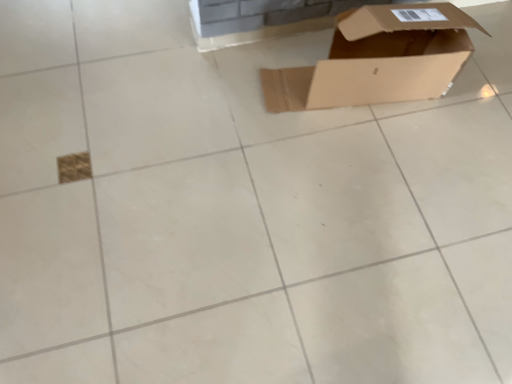
You are a GUI agent. You are given a task and a screenshot of the screen. Output one action in this format:
    pyautogui.click(x=<x>, y=<y>)
    Task: Click on the free space to the left of brown cardboard box at upper right
    This screenshot has width=512, height=384.
    Given the screenshot: What is the action you would take?
    pyautogui.click(x=218, y=92)